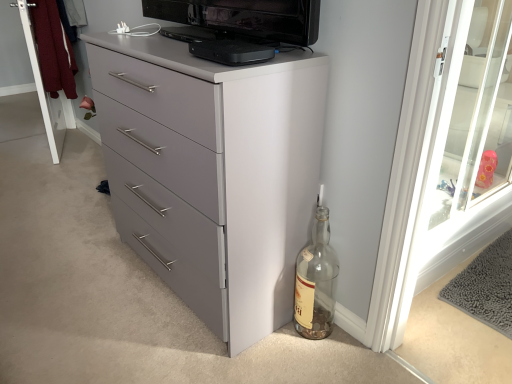
You are a GUI agent. You are given a task and a screenshot of the screen. Output one action in this format:
    pyautogui.click(x=<x>, y=<y>)
    Task: Click on the vacant space underneath black plastic device at upper center (from a real-world perspective)
    Image resolution: width=512 pixels, height=384 pixels.
    Given the screenshot: What is the action you would take?
    pyautogui.click(x=224, y=58)